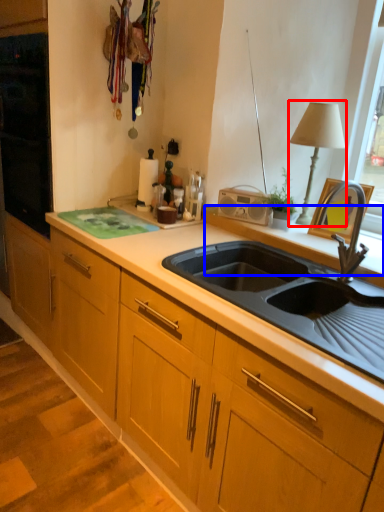
Question: Which object appears farthest to the camera in this image, table lamp (highlighted by a red box) or window sill (highlighted by a blue box)?

Choices:
 (A) table lamp
 (B) window sill

Answer: (A)